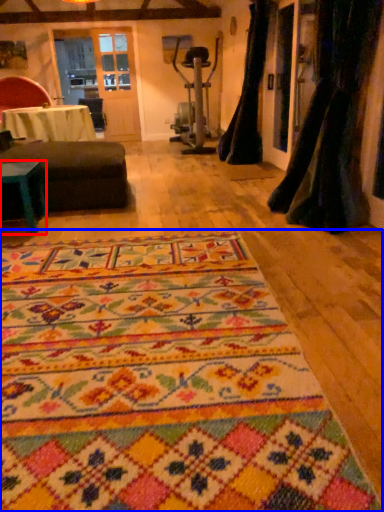
Question: Which object is further to the camera taking this photo, table (highlighted by a red box) or mat (highlighted by a blue box)?

Choices:
 (A) table
 (B) mat

Answer: (A)